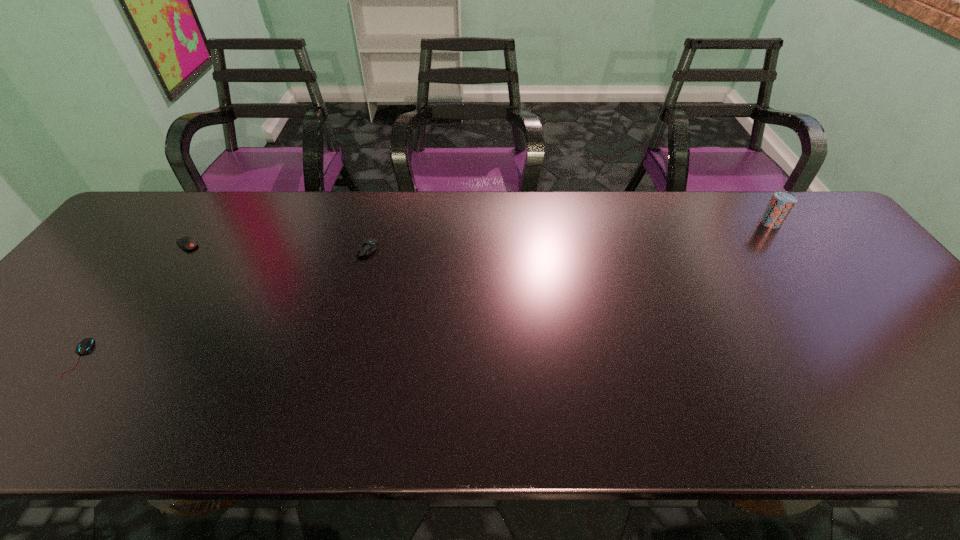
The width and height of the screenshot is (960, 540). Identify the location of blank region between the second object from left to right and the leftmost object. (132, 301).

Where is `free area in between the second object from right to left and the second mouse from right to left`? The image size is (960, 540). free area in between the second object from right to left and the second mouse from right to left is located at coordinates (276, 248).

I want to click on free space between the farthest object and the second mouse from left to right, so click(478, 234).

Where is `free space between the third object from right to left and the beer can`? free space between the third object from right to left and the beer can is located at coordinates (478, 234).

Where is `free point between the beer can and the second mouse from right to left`? The image size is (960, 540). free point between the beer can and the second mouse from right to left is located at coordinates [478, 234].

Where is `free space between the third object from right to left and the third object from left to right`? This screenshot has width=960, height=540. free space between the third object from right to left and the third object from left to right is located at coordinates coord(276,248).

At what (x,y) coordinates should I click in order to perform the action: click on vacant area between the second object from right to left and the third object from right to left. Please return your answer as a coordinate pair (x, y). This screenshot has height=540, width=960. Looking at the image, I should click on (276, 248).

Where is `free area in between the rightmost object and the third object from left to right`? This screenshot has width=960, height=540. free area in between the rightmost object and the third object from left to right is located at coordinates (568, 237).

Identify the location of vacant point located between the leftmost object and the rightmost mouse. The width and height of the screenshot is (960, 540). (222, 304).

Identify which object is the second nearest to the rightmost mouse. Please provide its 2D coordinates. Your answer should be formatted as a tuple, i.e. [(x, y)], where the tuple contains the x and y coordinates of a point satisfying the conditions above.

[(86, 344)]